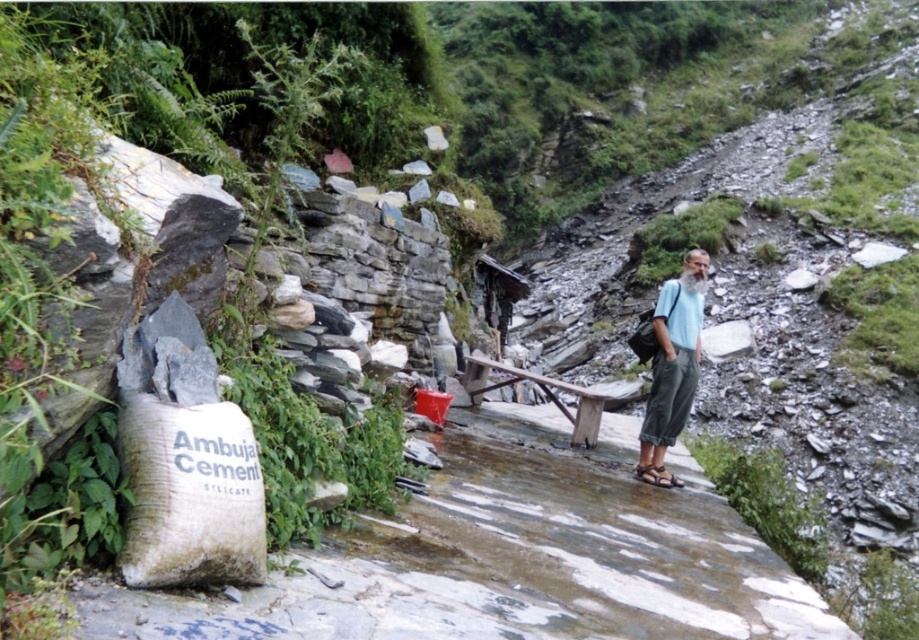
You are a hiker who wants to walk along the white stone path at center while avoiding the man in the light blue fabric shirt at right. Which direction should you walk to stay on the path and avoid him?

The white stone path at center is to the left of the light blue fabric shirt at right, so you should walk to the left side of the path to avoid the man.

You are a hiker planning to walk along the white stone path at center. You are wearing a light blue fabric shirt at right. Can your shirt fit on the path without overlapping the edges?

The white stone path at center is narrower than the light blue fabric shirt at right, so the shirt cannot fit on the path without overlapping the edges.